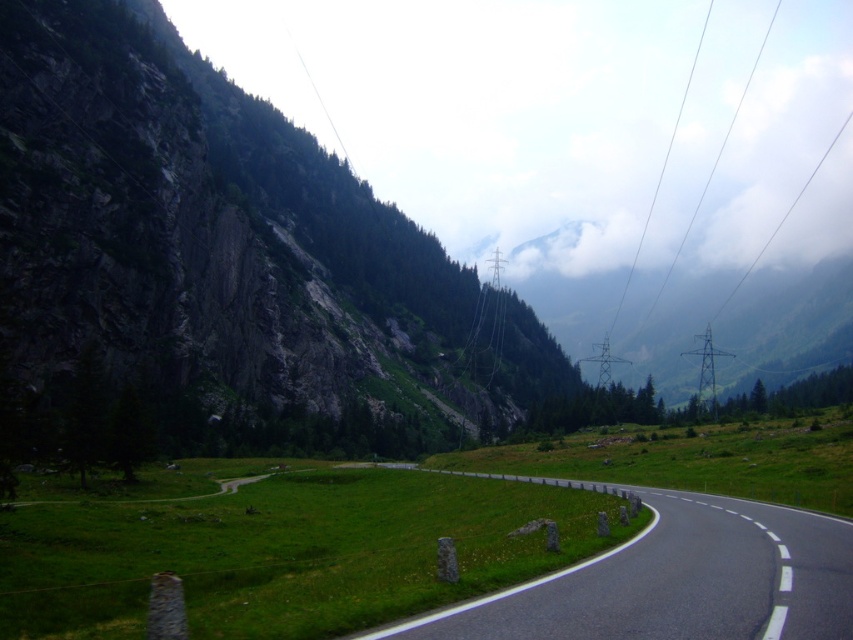
Who is positioned more to the right, rugged stone mountain at left or black asphalt road at center?

From the viewer's perspective, black asphalt road at center appears more on the right side.

The image size is (853, 640). What do you see at coordinates (225, 243) in the screenshot? I see `rugged stone mountain at left` at bounding box center [225, 243].

Between point (315, 273) and point (772, 572), which one is positioned behind?

Positioned behind is point (315, 273).

This screenshot has height=640, width=853. Identify the location of rugged stone mountain at left. (225, 243).